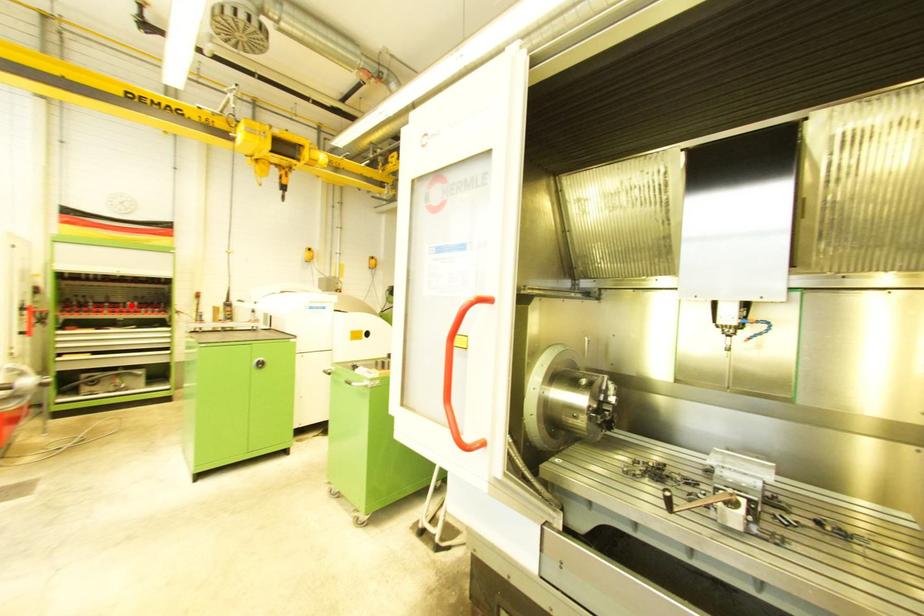
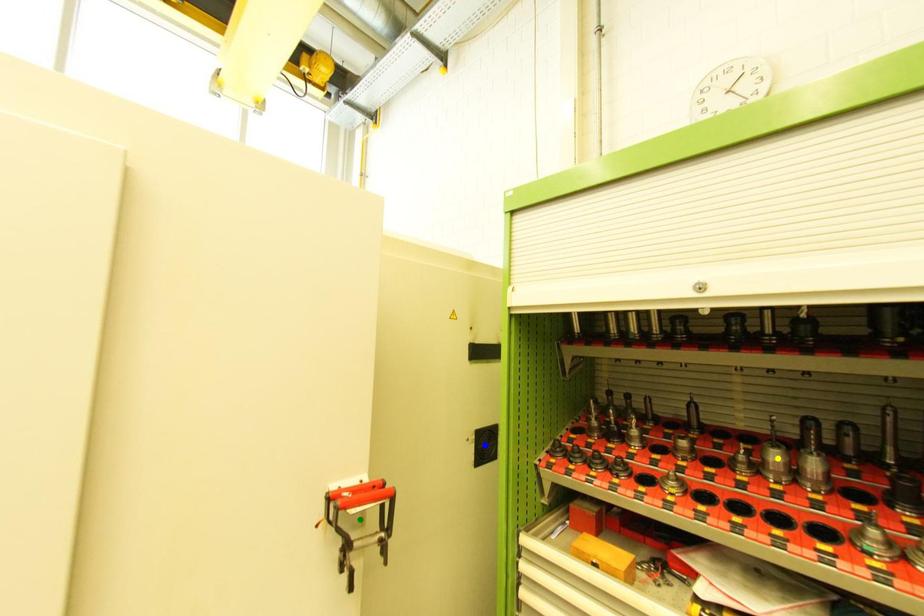
Question: I am providing you with two images of the same scene from different viewpoints. A red point is marked on the first image. You are given multiple points on the second image. Can you choose the point in image 2 that corresponds to the point in image 1?

Choices:
 (A) yellow point
 (B) blue point
 (C) green point

Answer: (A)